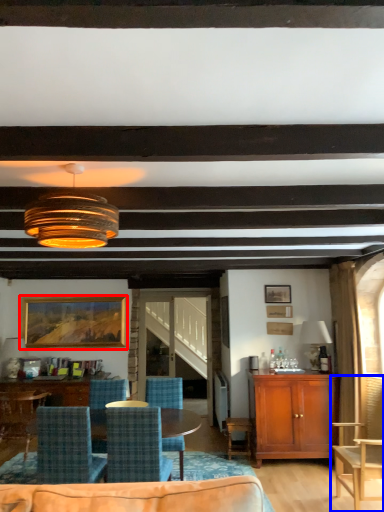
Question: Which object is further to the camera taking this photo, picture frame (highlighted by a red box) or chair (highlighted by a blue box)?

Choices:
 (A) picture frame
 (B) chair

Answer: (A)